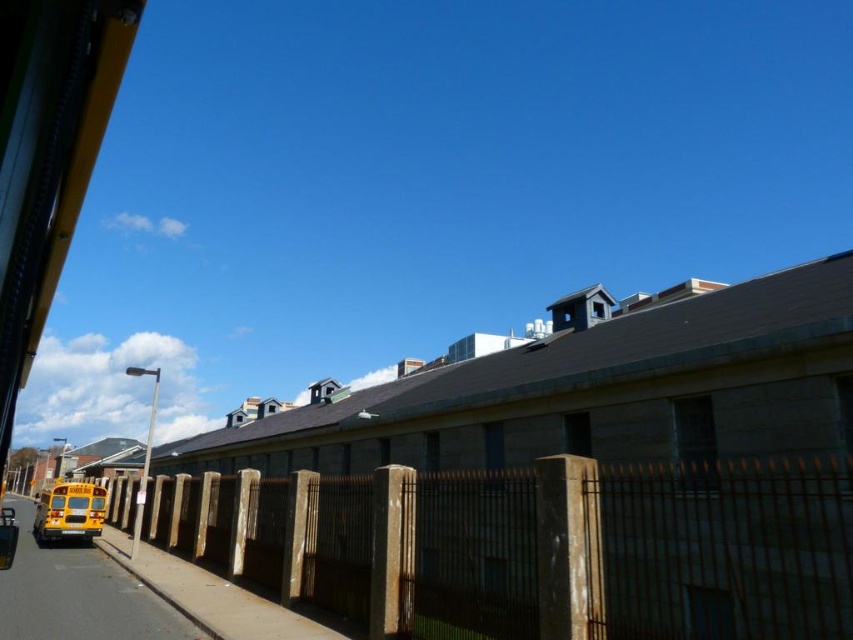
From the picture: Which is below, rusty metal fence at lower left or smooth asphalt road at lower left?

Positioned lower is smooth asphalt road at lower left.

Is point (718, 540) positioned behind point (70, 616)?

Yes, it is behind point (70, 616).

Where is `rusty metal fence at lower left`? The width and height of the screenshot is (853, 640). rusty metal fence at lower left is located at coordinates (534, 547).